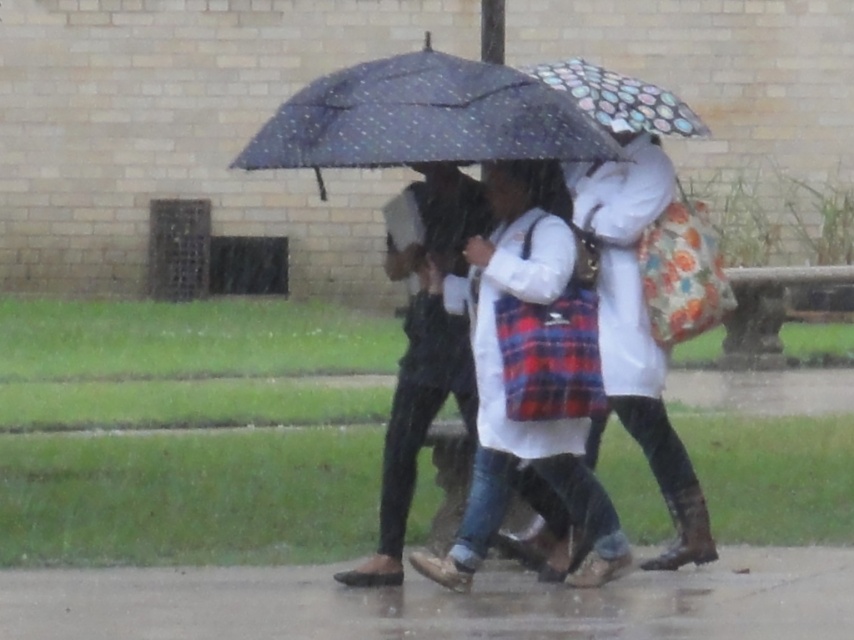
Question: Does polka dot fabric umbrella at center appear on the left side of polka dot fabric umbrella at upper center?

Choices:
 (A) yes
 (B) no

Answer: (A)

Question: Which object appears closest to the camera in this image?

Choices:
 (A) white cotton coat at center
 (B) polka dot fabric umbrella at upper center
 (C) damp concrete pavement at lower center
 (D) polka dot fabric umbrella at center

Answer: (D)

Question: Is damp concrete pavement at lower center thinner than polka dot fabric umbrella at center?

Choices:
 (A) yes
 (B) no

Answer: (B)

Question: Is polka dot fabric umbrella at center bigger than white cotton coat at center?

Choices:
 (A) no
 (B) yes

Answer: (A)

Question: Which object is the farthest from the damp concrete pavement at lower center?

Choices:
 (A) polka dot fabric umbrella at upper center
 (B) white cotton coat at center

Answer: (A)

Question: Which of the following is the closest to the observer?

Choices:
 (A) (480, 189)
 (B) (550, 118)
 (C) (659, 112)

Answer: (B)